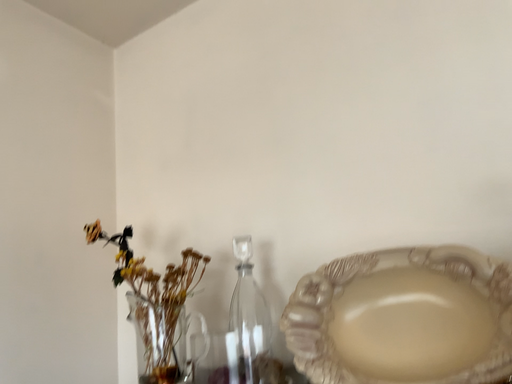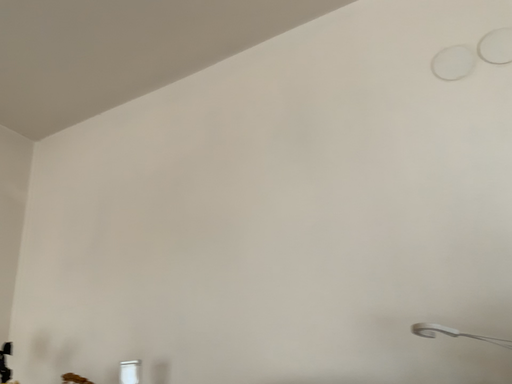
Question: Which way did the camera rotate in the video?

Choices:
 (A) rotated upward
 (B) rotated downward

Answer: (A)